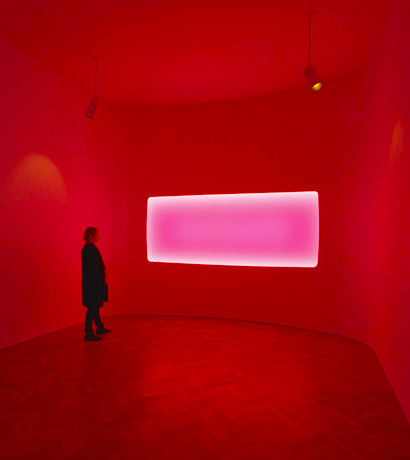
Locate an element on the screen. red room is located at coordinates (360, 287).